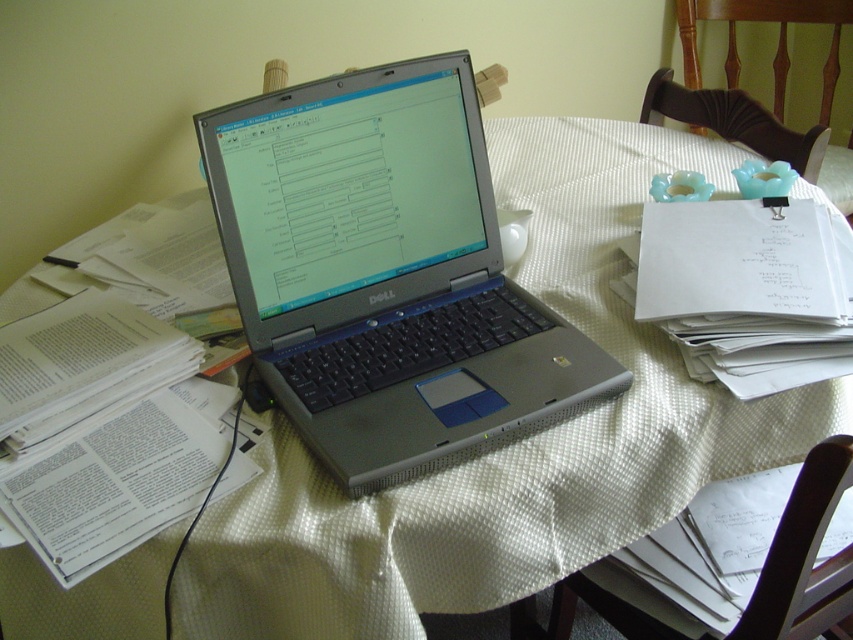
Question: Which point is closer to the camera?

Choices:
 (A) silver metallic laptop at center
 (B) white paper at upper right

Answer: (A)

Question: Does silver metallic laptop at center appear over white paper at upper right?

Choices:
 (A) yes
 (B) no

Answer: (B)

Question: Is silver metallic laptop at center thinner than white paper at upper right?

Choices:
 (A) no
 (B) yes

Answer: (A)

Question: Is silver metallic laptop at center to the left of white paper at upper right from the viewer's perspective?

Choices:
 (A) yes
 (B) no

Answer: (A)

Question: Which point is farther to the camera?

Choices:
 (A) (415, 61)
 (B) (727, 323)

Answer: (A)